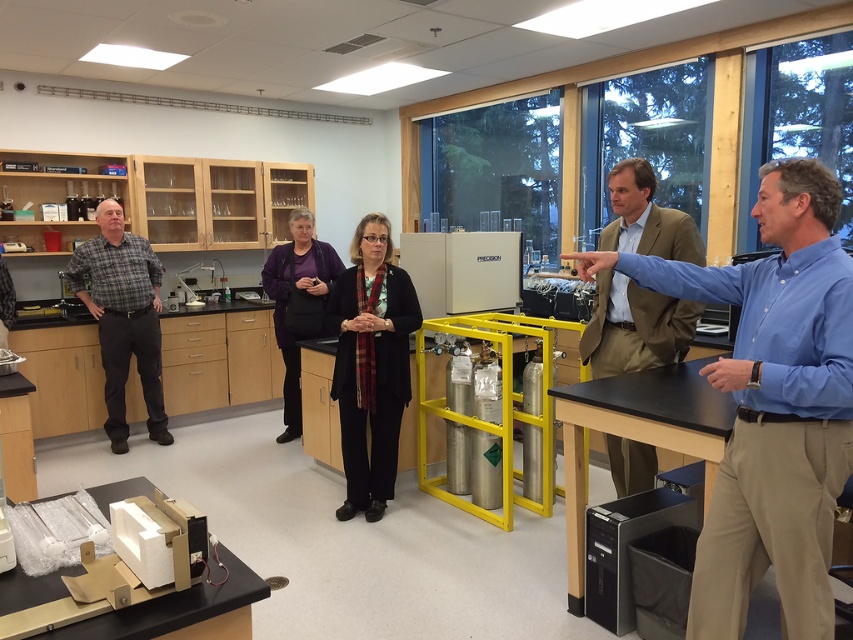
Is khaki cotton blazer at center thinner than plaid shirt at left?

Yes, khaki cotton blazer at center is thinner than plaid shirt at left.

What do you see at coordinates (634, 326) in the screenshot? This screenshot has height=640, width=853. I see `khaki cotton blazer at center` at bounding box center [634, 326].

Locate an element on the screen. Image resolution: width=853 pixels, height=640 pixels. khaki cotton blazer at center is located at coordinates (634, 326).

Does blue shirt at center appear under khaki cotton blazer at center?

Yes.

Does blue shirt at center lie in front of khaki cotton blazer at center?

That is True.

What are the coordinates of `blue shirt at center` in the screenshot? It's located at [772, 404].

Does blue shirt at center have a lesser height compared to plaid shirt at left?

Indeed, blue shirt at center has a lesser height compared to plaid shirt at left.

Is blue shirt at center smaller than plaid shirt at left?

No, blue shirt at center is not smaller than plaid shirt at left.

Measure the distance between blue shirt at center and camera.

The distance of blue shirt at center from camera is 5.26 feet.

Locate an element on the screen. The height and width of the screenshot is (640, 853). blue shirt at center is located at coordinates (772, 404).